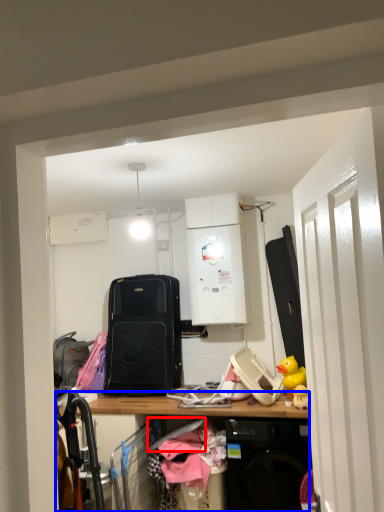
Question: Which object is further to the camera taking this photo, hanger (highlighted by a red box) or desk (highlighted by a blue box)?

Choices:
 (A) hanger
 (B) desk

Answer: (A)